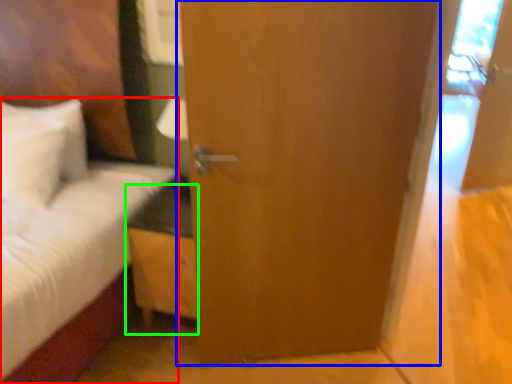
Question: Considering the real-world distances, which object is closest to bed (highlighted by a red box)? door (highlighted by a blue box) or nightstand (highlighted by a green box).

Choices:
 (A) door
 (B) nightstand

Answer: (B)